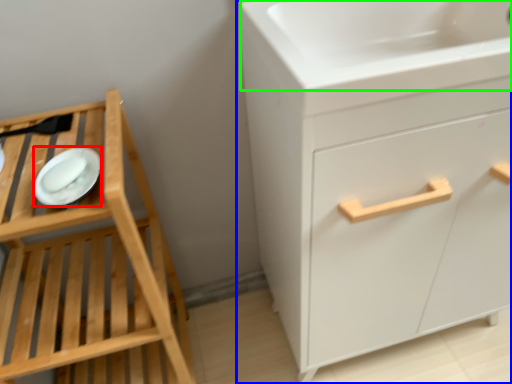
Question: Which is nearer to the platter (highlighted by a red box)? chest of drawers (highlighted by a blue box) or sink (highlighted by a green box).

Choices:
 (A) chest of drawers
 (B) sink

Answer: (B)